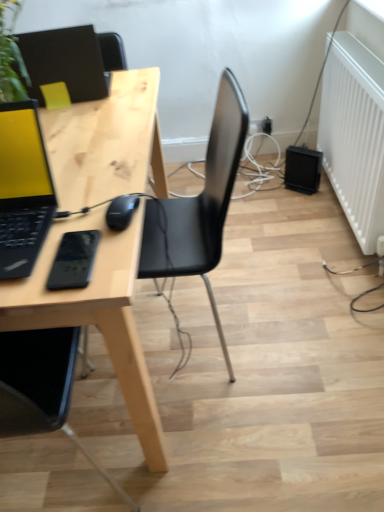
Image resolution: width=384 pixels, height=512 pixels. What are the coordinates of `vacant space in front of black plastic speaker at lower right` in the screenshot? It's located at (309, 204).